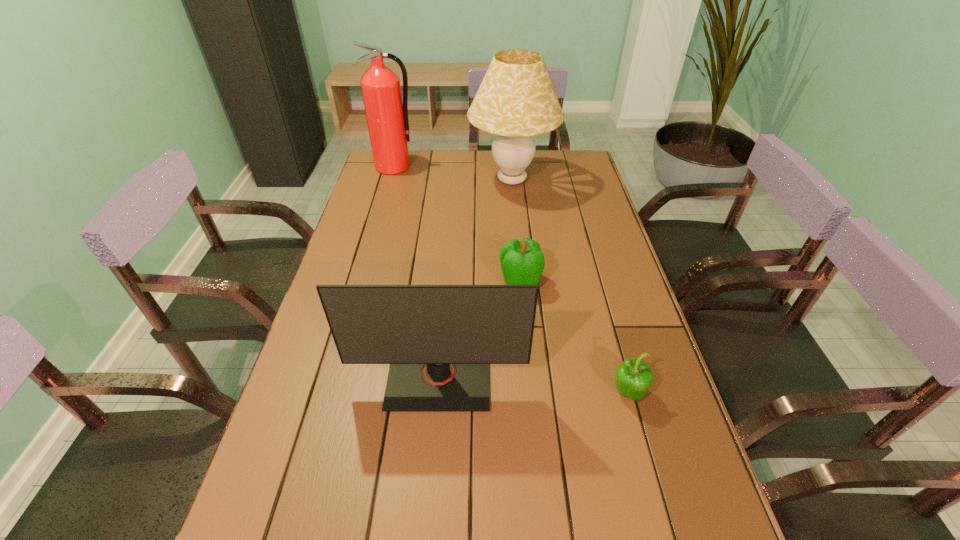
Where is `fire extinguisher`? fire extinguisher is located at coordinates (387, 115).

Find the location of a particular element. lampshade is located at coordinates (516, 100).

Identify the location of the third shortest object. Image resolution: width=960 pixels, height=540 pixels. (439, 340).

The height and width of the screenshot is (540, 960). In order to click on the left bell pepper in this screenshot , I will do `click(522, 262)`.

Locate an element on the screen. the farther bell pepper is located at coordinates (522, 262).

Where is `the shortest object`? the shortest object is located at coordinates (633, 377).

The width and height of the screenshot is (960, 540). Identify the location of the right bell pepper. (633, 377).

Locate an element on the screen. vacant space located 0.300m at the nozzle of the fire extinguisher is located at coordinates (378, 221).

The width and height of the screenshot is (960, 540). Find the location of `free spot located on the front of the lampshade`. free spot located on the front of the lampshade is located at coordinates (516, 224).

This screenshot has width=960, height=540. I want to click on vacant region located 0.110m on the screen side of the monitor, so click(432, 464).